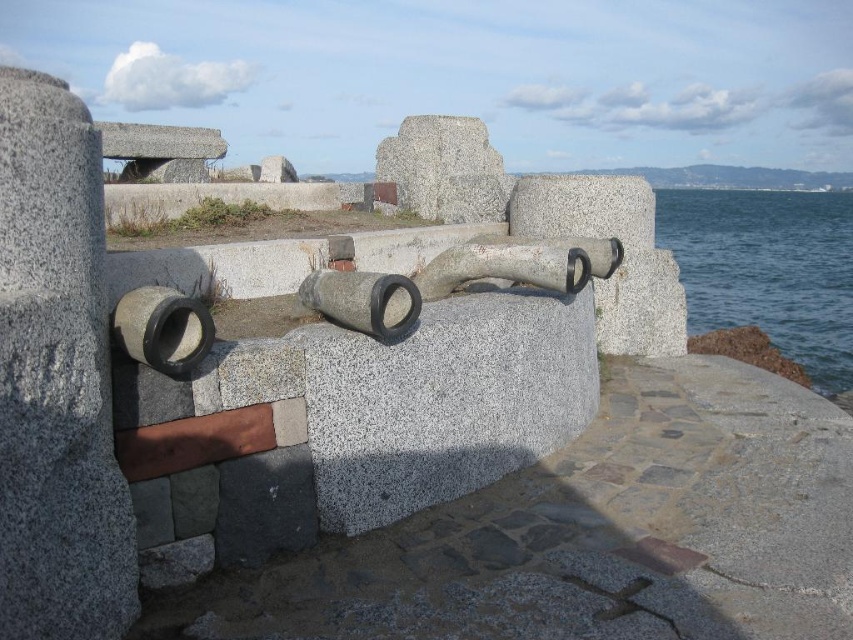
Question: Among these objects, which one is farthest from the camera?

Choices:
 (A) gray stone cannon at center
 (B) blue water at lower right

Answer: (B)

Question: Where is blue water at lower right located in relation to gray stone cannon at center in the image?

Choices:
 (A) above
 (B) below

Answer: (A)

Question: Is blue water at lower right positioned at the back of gray stone cannon at center?

Choices:
 (A) no
 (B) yes

Answer: (B)

Question: Does blue water at lower right have a smaller size compared to gray stone cannon at center?

Choices:
 (A) yes
 (B) no

Answer: (B)

Question: Which object appears farthest from the camera in this image?

Choices:
 (A) gray stone cannon at center
 (B) blue water at lower right

Answer: (B)